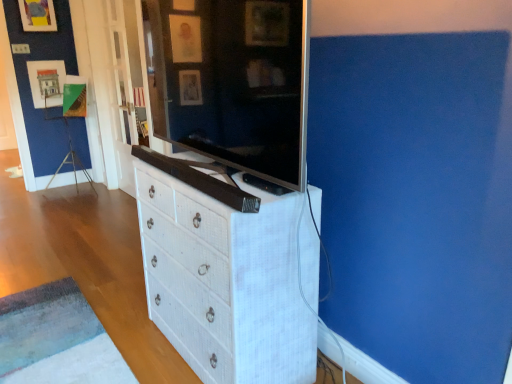
Question: Would you say matte black television at center is to the left or to the right of white textured chest of drawers at center in the picture?

Choices:
 (A) left
 (B) right

Answer: (A)

Question: Is point (203, 130) closer or farther from the camera than point (269, 218)?

Choices:
 (A) farther
 (B) closer

Answer: (A)

Question: Considering the positions of matte black television at center and white textured chest of drawers at center in the image, is matte black television at center bigger or smaller than white textured chest of drawers at center?

Choices:
 (A) big
 (B) small

Answer: (B)

Question: From a real-world perspective, is white textured chest of drawers at center above or below matte black television at center?

Choices:
 (A) below
 (B) above

Answer: (A)

Question: Is point (217, 288) closer or farther from the camera than point (167, 24)?

Choices:
 (A) closer
 (B) farther

Answer: (A)

Question: Is white textured chest of drawers at center in front of or behind matte black television at center in the image?

Choices:
 (A) front
 (B) behind

Answer: (B)

Question: From the image's perspective, relative to matte black television at center, is white textured chest of drawers at center above or below?

Choices:
 (A) above
 (B) below

Answer: (B)